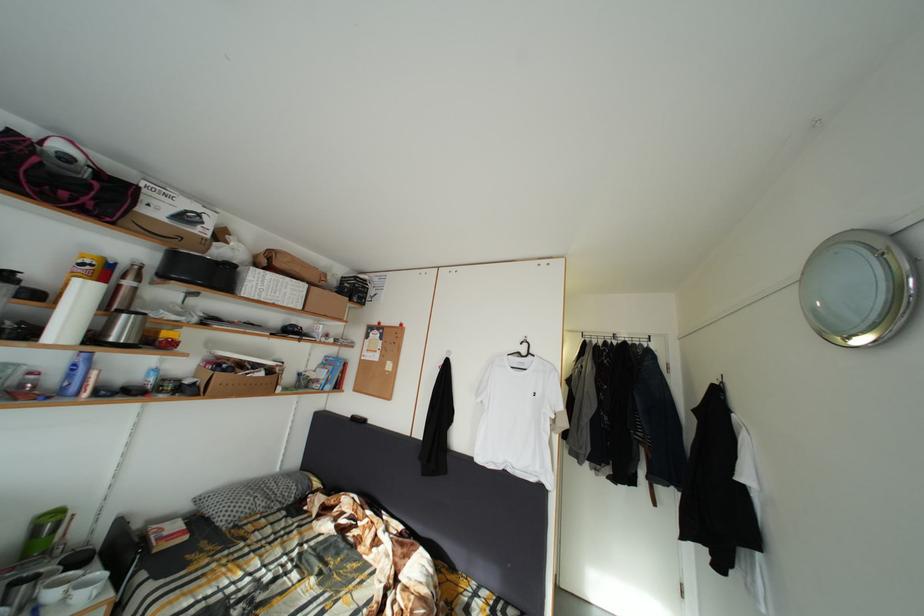
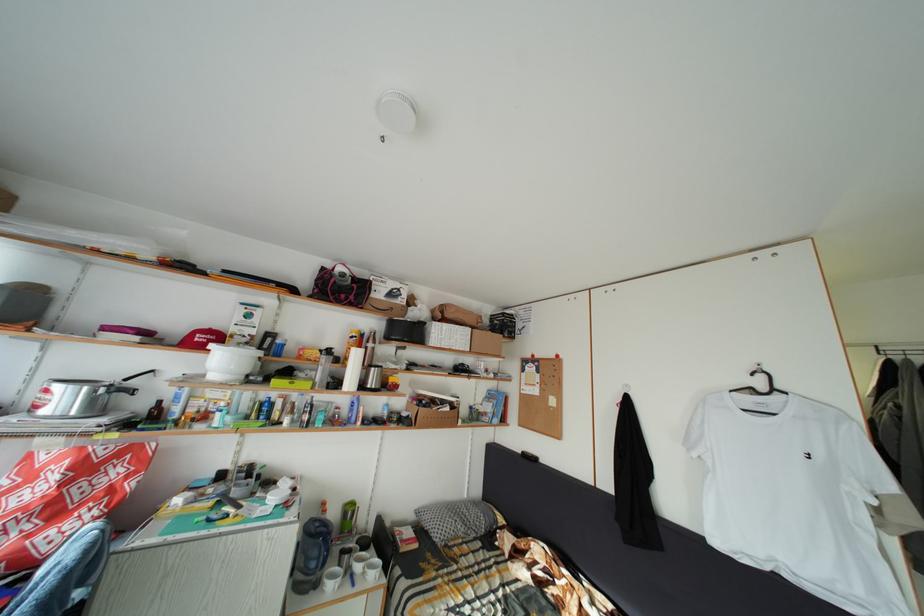
Question: The camera is either moving clockwise (left) or counter-clockwise (right) around the object. The first image is from the beginning of the video and the second image is from the end. Is the camera moving left or right when shooting the video?

Choices:
 (A) Left
 (B) Right

Answer: (B)